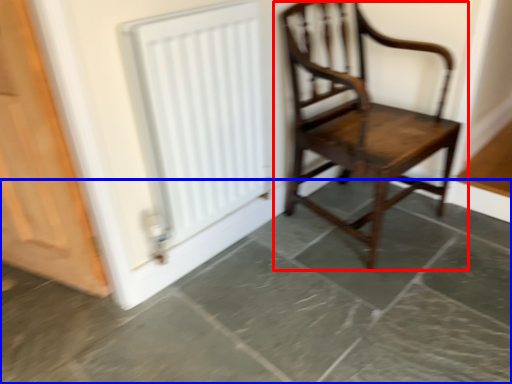
Question: Which object appears closest to the camera in this image, chair (highlighted by a red box) or concrete (highlighted by a blue box)?

Choices:
 (A) chair
 (B) concrete

Answer: (B)